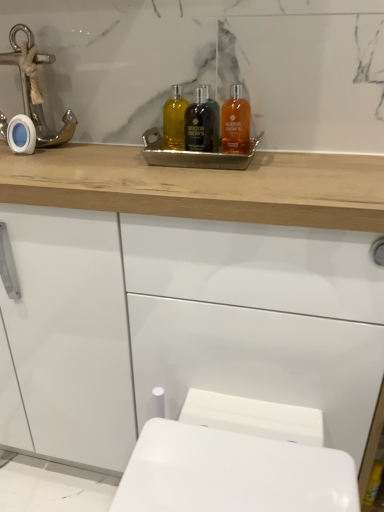
Where is `free location in front of translucent amber liquid at center, marked as the 3th mouthwash in a right-to-left arrangement`? The width and height of the screenshot is (384, 512). free location in front of translucent amber liquid at center, marked as the 3th mouthwash in a right-to-left arrangement is located at coordinates (178, 170).